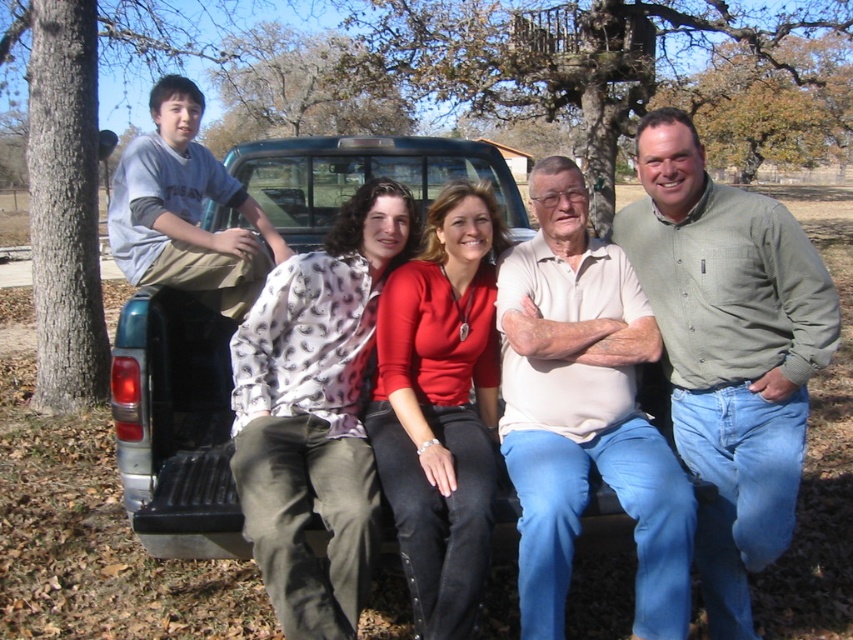
Question: Which point appears farthest from the camera in this image?

Choices:
 (A) (828, 593)
 (B) (520, 205)
 (C) (675, 561)
 (D) (477, 292)

Answer: (B)

Question: Considering the relative positions of matte khaki pants at center and green button-down shirt at center in the image provided, where is matte khaki pants at center located with respect to green button-down shirt at center?

Choices:
 (A) left
 (B) right

Answer: (B)

Question: Does light beige cotton shirt at center have a larger size compared to teal matte truck bed at center?

Choices:
 (A) no
 (B) yes

Answer: (A)

Question: Among these objects, which one is farthest from the camera?

Choices:
 (A) matte khaki pants at center
 (B) light beige cotton shirt at center

Answer: (A)

Question: Estimate the real-world distances between objects in this image. Which object is closer to the light beige cotton shirt at center?

Choices:
 (A) matte black truck at center
 (B) teal matte truck bed at center

Answer: (A)

Question: Does light beige cotton shirt at center have a larger size compared to matte black truck at center?

Choices:
 (A) yes
 (B) no

Answer: (B)